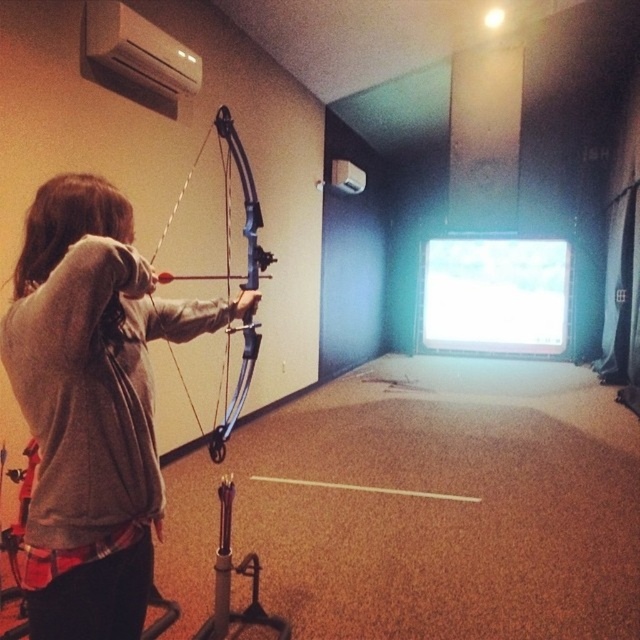
Between matte gray hoodie at left and blue matte bow at center, which one is positioned lower?

matte gray hoodie at left

Between point (33, 637) and point (253, 358), which one is positioned behind?

Point (253, 358)

Who is more distant from viewer, (93, 433) or (196, 417)?

The point (196, 417) is behind.

Find the location of a particular element. Image resolution: width=640 pixels, height=640 pixels. matte gray hoodie at left is located at coordinates (92, 404).